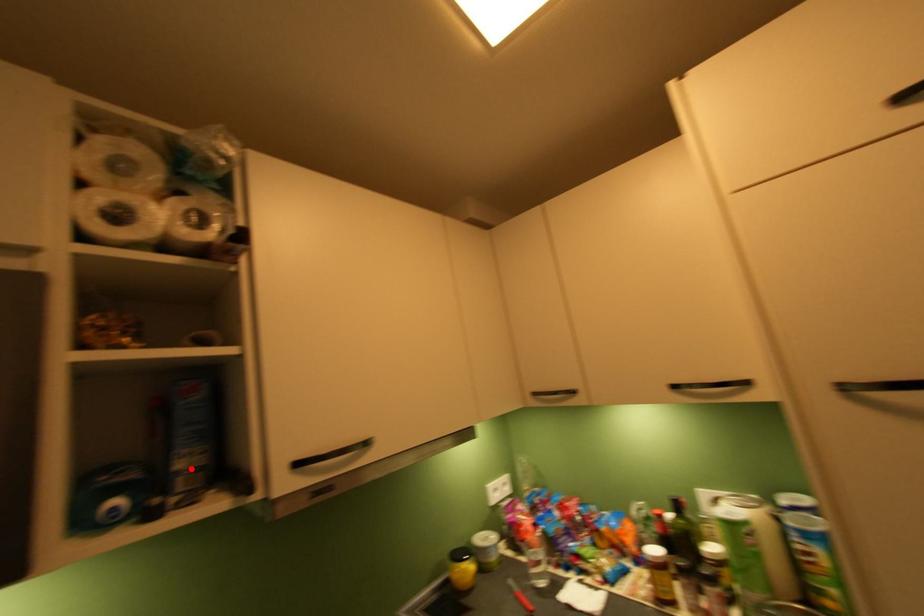
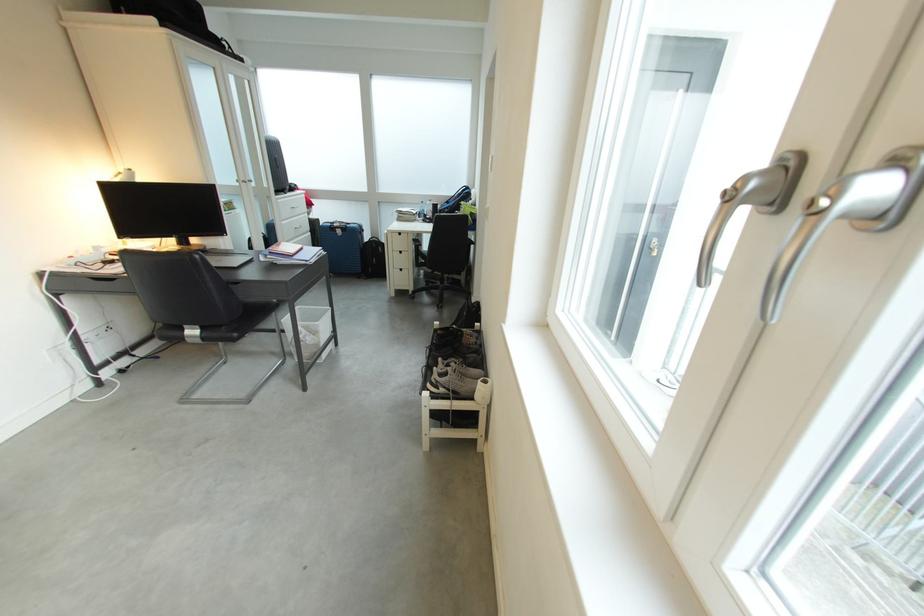
Question: I am providing you with two images of the same scene from different viewpoints. A red point is marked on the first image. At the location where the point appears in image 1, is it still visible in image 2?

Choices:
 (A) Yes
 (B) No

Answer: (B)